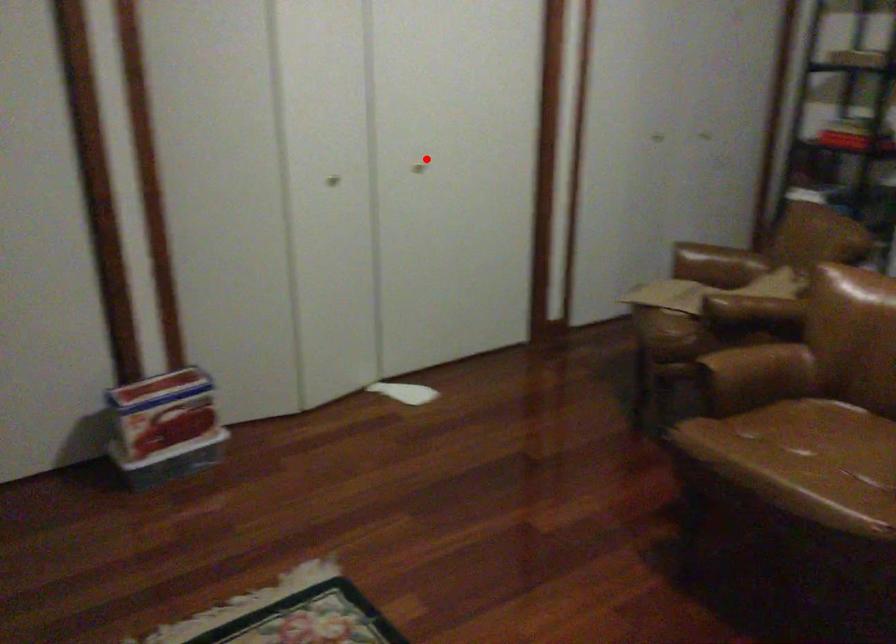
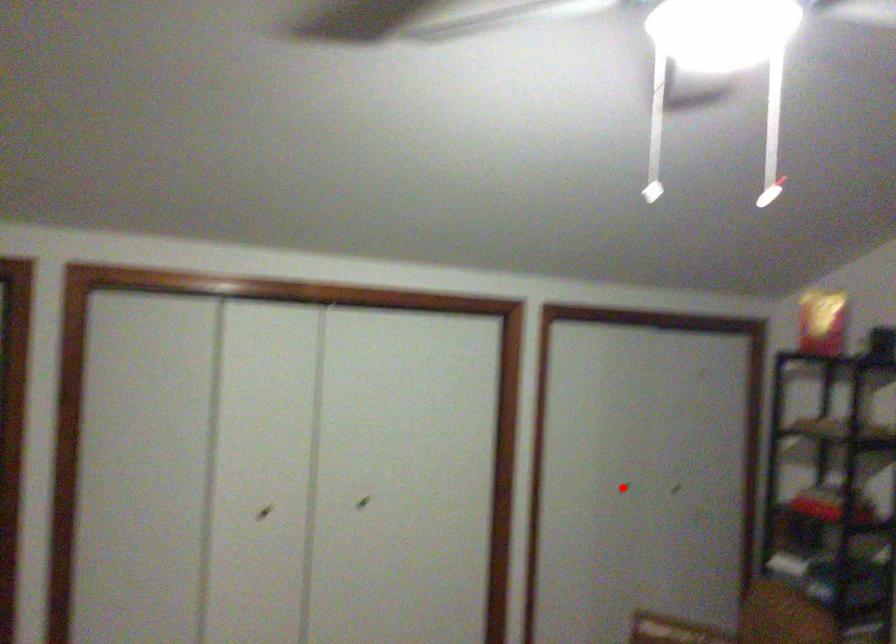
I am providing you with two images of the same scene from different viewpoints. A red point is marked on the first image and another point is marked on the second image. Does the point marked in image1 correspond to the same location as the one in image2?

No